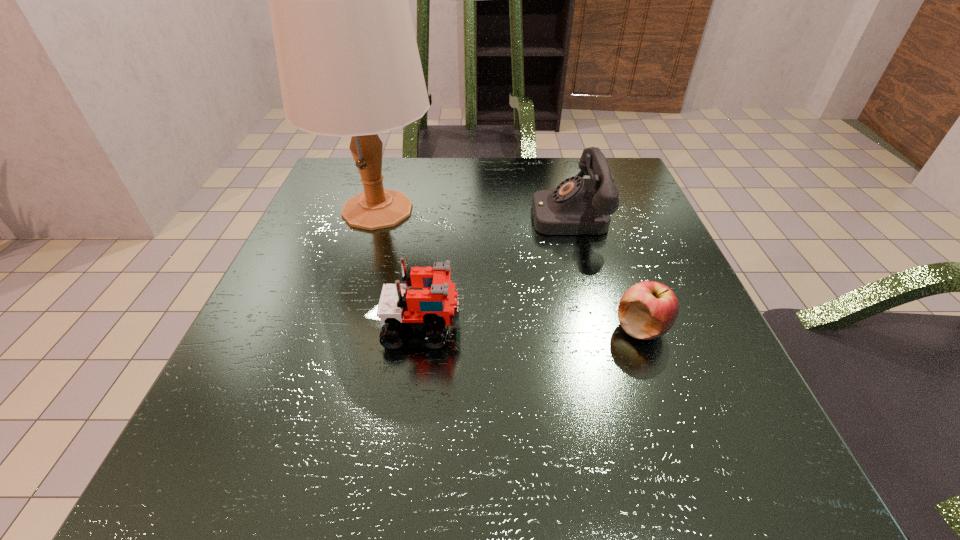
Locate an element on the screen. This screenshot has width=960, height=540. free space between the Lego and the telephone is located at coordinates (495, 270).

This screenshot has height=540, width=960. In order to click on free spot between the tallest object and the shortest object in this screenshot , I will do `click(510, 269)`.

Image resolution: width=960 pixels, height=540 pixels. What are the coordinates of `blank region between the tallest object and the apple` in the screenshot? It's located at (510, 269).

Where is `object that is the third closest to the Lego`? object that is the third closest to the Lego is located at coordinates (647, 310).

This screenshot has height=540, width=960. In order to click on object that ranks as the third closest to the table lamp in this screenshot , I will do `click(647, 310)`.

Locate an element on the screen. The width and height of the screenshot is (960, 540). vacant space that satisfies the following two spatial constraints: 1. on the back side of the apple; 2. on the dial of the telephone is located at coordinates (600, 213).

Where is `free location that satisfies the following two spatial constraints: 1. on the front-facing side of the Lego; 2. on the right side of the shortest object`? The height and width of the screenshot is (540, 960). free location that satisfies the following two spatial constraints: 1. on the front-facing side of the Lego; 2. on the right side of the shortest object is located at coordinates (422, 328).

At what (x,y) coordinates should I click in order to perform the action: click on vacant space that satisfies the following two spatial constraints: 1. on the front-facing side of the Lego; 2. on the right side of the shortest object. Please return your answer as a coordinate pair (x, y). Image resolution: width=960 pixels, height=540 pixels. Looking at the image, I should click on (422, 328).

The width and height of the screenshot is (960, 540). Find the location of `free point that satisfies the following two spatial constraints: 1. on the dial of the telephone; 2. on the back side of the apple`. free point that satisfies the following two spatial constraints: 1. on the dial of the telephone; 2. on the back side of the apple is located at coordinates (597, 328).